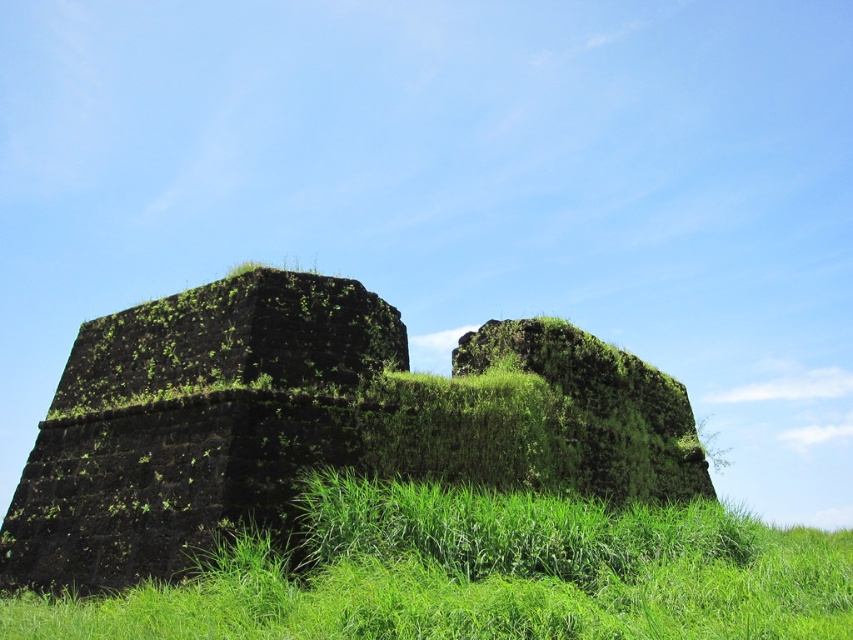
Is point (204, 449) farther from viewer compared to point (692, 516)?

No, it is in front of (692, 516).

This screenshot has width=853, height=640. Find the location of `green mossy stone wall at center`. green mossy stone wall at center is located at coordinates (314, 422).